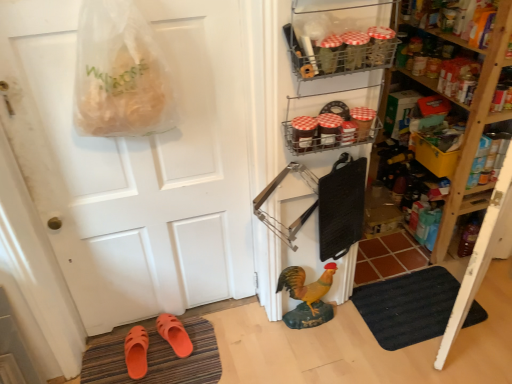
You are a GUI agent. You are given a task and a screenshot of the screen. Output one action in this format:
    pyautogui.click(x=<x>, y=<y>)
    Task: Click on the vacant area situated below metallic wire rack at upper center, marked as the 2th shelf in a front-to-back arrangement (from a real-world perspective)
    The width and height of the screenshot is (512, 384).
    Given the screenshot: What is the action you would take?
    pyautogui.click(x=323, y=328)